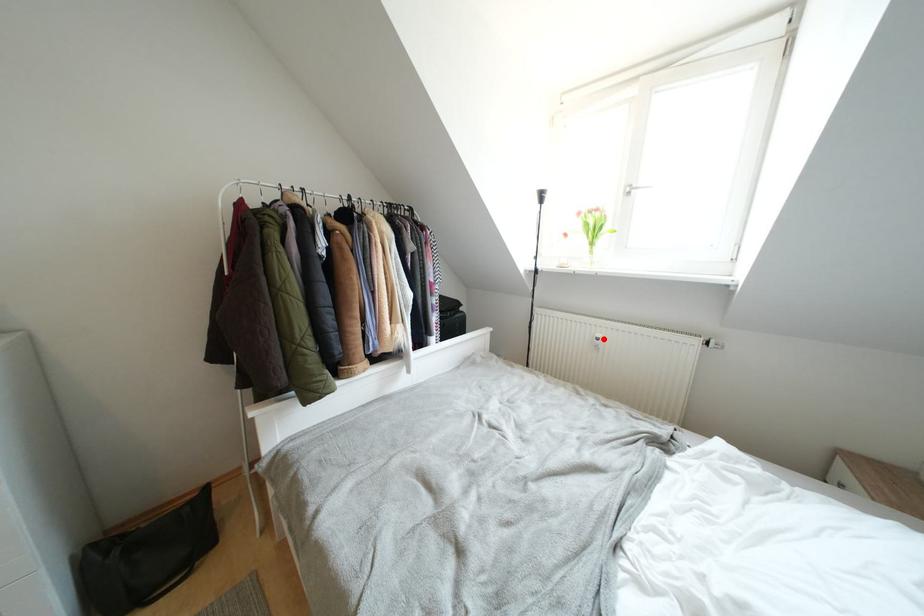
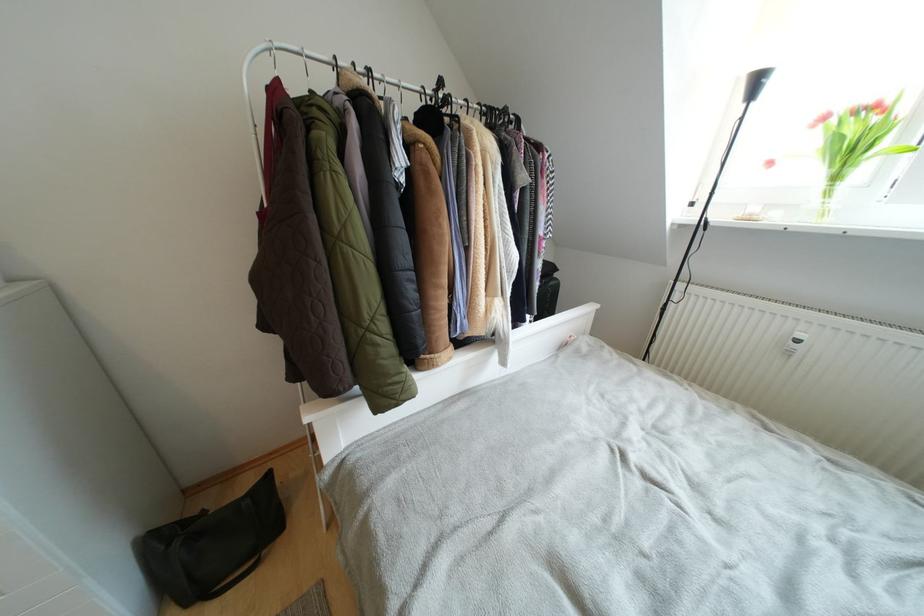
Question: I am providing you with two images of the same scene from different viewpoints. A red point is marked on the first image. Is the red point's position out of view in image 2?

Choices:
 (A) Yes
 (B) No

Answer: (B)